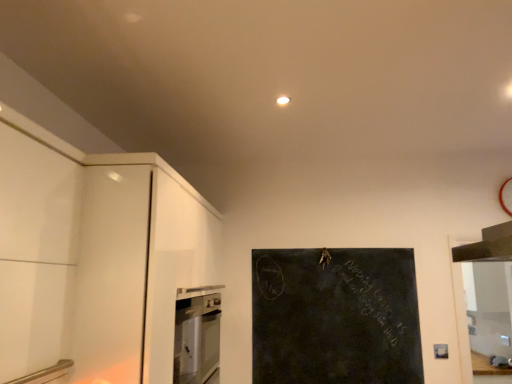
Question: Is satin stainless steel dishwasher at lower left not inside black chalkboard at center?

Choices:
 (A) yes
 (B) no

Answer: (A)

Question: From a real-world perspective, is satin stainless steel dishwasher at lower left located higher than black chalkboard at center?

Choices:
 (A) no
 (B) yes

Answer: (A)

Question: Does satin stainless steel dishwasher at lower left come behind black chalkboard at center?

Choices:
 (A) yes
 (B) no

Answer: (B)

Question: Are satin stainless steel dishwasher at lower left and black chalkboard at center far apart?

Choices:
 (A) yes
 (B) no

Answer: (B)

Question: Considering the relative sizes of satin stainless steel dishwasher at lower left and black chalkboard at center in the image provided, is satin stainless steel dishwasher at lower left taller than black chalkboard at center?

Choices:
 (A) yes
 (B) no

Answer: (B)

Question: Can you confirm if satin stainless steel dishwasher at lower left is bigger than black chalkboard at center?

Choices:
 (A) no
 (B) yes

Answer: (B)

Question: From the image's perspective, would you say black chalkboard at center is shown under satin stainless steel dishwasher at lower left?

Choices:
 (A) no
 (B) yes

Answer: (A)

Question: Would you say black chalkboard at center is outside satin stainless steel dishwasher at lower left?

Choices:
 (A) yes
 (B) no

Answer: (A)

Question: Considering the relative sizes of black chalkboard at center and satin stainless steel dishwasher at lower left in the image provided, is black chalkboard at center shorter than satin stainless steel dishwasher at lower left?

Choices:
 (A) no
 (B) yes

Answer: (A)

Question: Is there a large distance between black chalkboard at center and satin stainless steel dishwasher at lower left?

Choices:
 (A) no
 (B) yes

Answer: (A)

Question: Can you confirm if black chalkboard at center is taller than satin stainless steel dishwasher at lower left?

Choices:
 (A) no
 (B) yes

Answer: (B)

Question: From a real-world perspective, is black chalkboard at center below satin stainless steel dishwasher at lower left?

Choices:
 (A) yes
 (B) no

Answer: (B)

Question: Considering the positions of black chalkboard at center and satin stainless steel dishwasher at lower left in the image, is black chalkboard at center bigger or smaller than satin stainless steel dishwasher at lower left?

Choices:
 (A) small
 (B) big

Answer: (A)